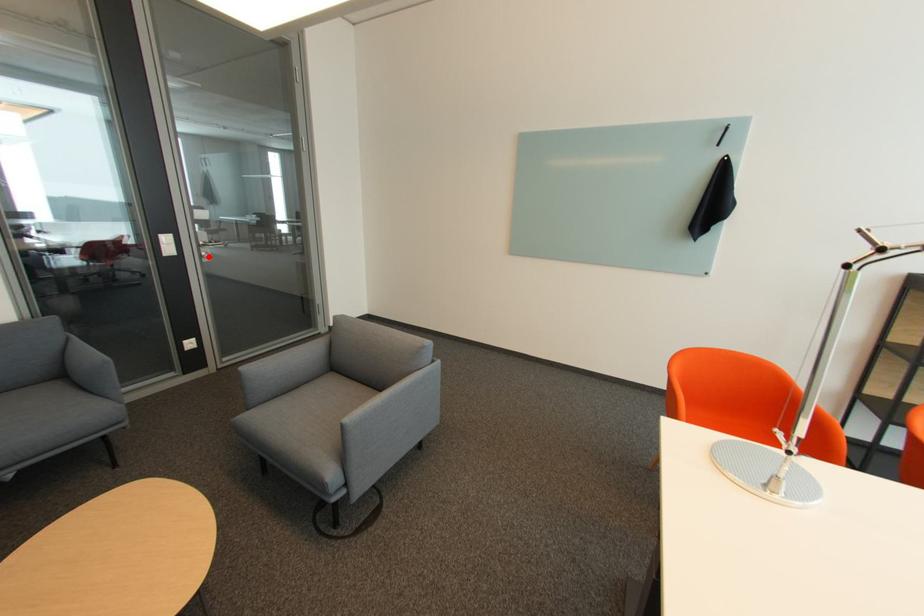
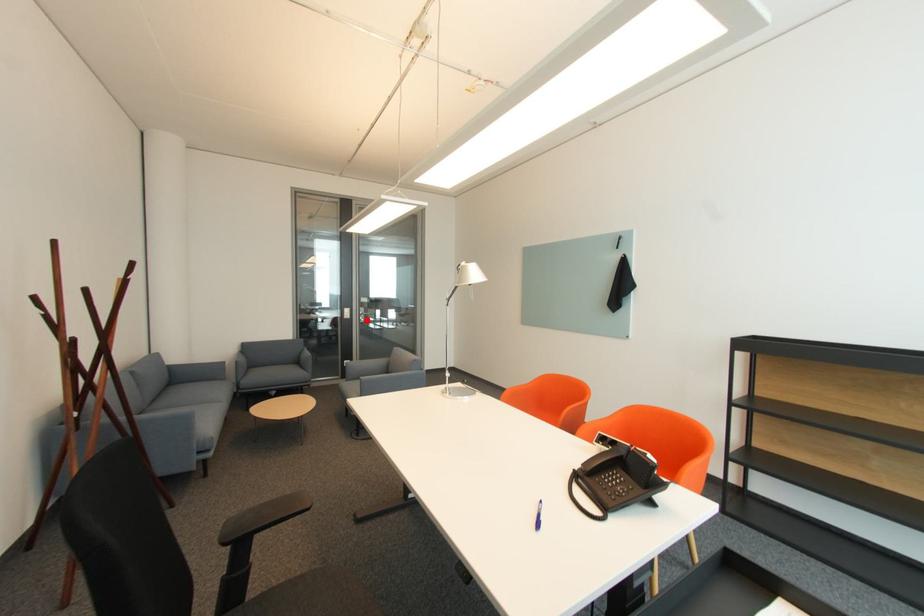
I am providing you with two images of the same scene from different viewpoints. A red point is marked on the first image and another point is marked on the second image. Is the marked point in image1 the same physical position as the marked point in image2?

Yes